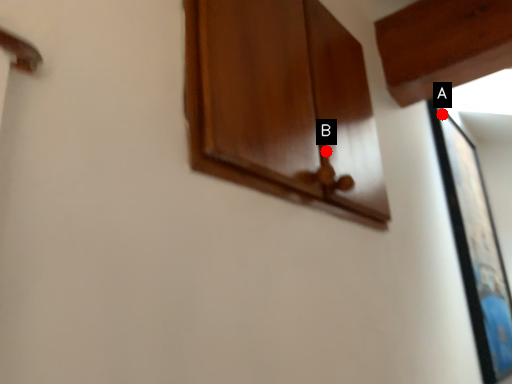
Question: Two points are circled on the image, labeled by A and B beside each circle. Among these points, which one is nearest to the camera?

Choices:
 (A) A is closer
 (B) B is closer

Answer: (B)